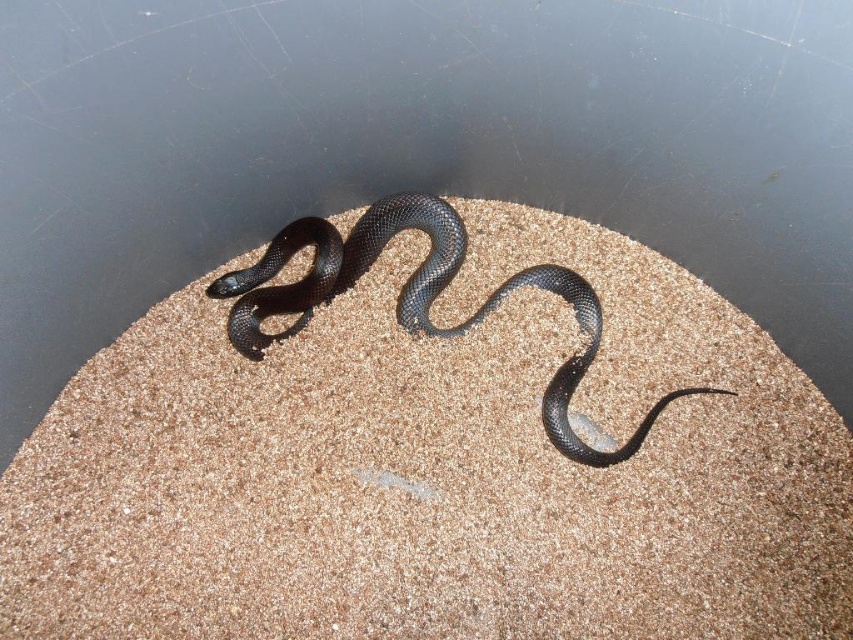
You are a photographer trying to capture the shiny black snake at center. You notice the brown textured sand at center in the image. Where should you position your camera relative to the snake to ensure the sand is visible in the background?

The brown textured sand at center is located below the shiny black snake at center, so positioning the camera below the snake would allow the sand to appear in the background behind it.

You are a photographer trying to capture the shiny black snake at center. You need to ensure the brown textured sand at center is fully visible in the frame. Given that the sand is wider than the snake, how should you adjust your camera angle to include both?

Since the brown textured sand at center is wider than the shiny black snake at center, you should position your camera to capture the broader area of the sand while ensuring the snake remains centered. This way, both the wider sand and the snake will be fully visible in the frame.